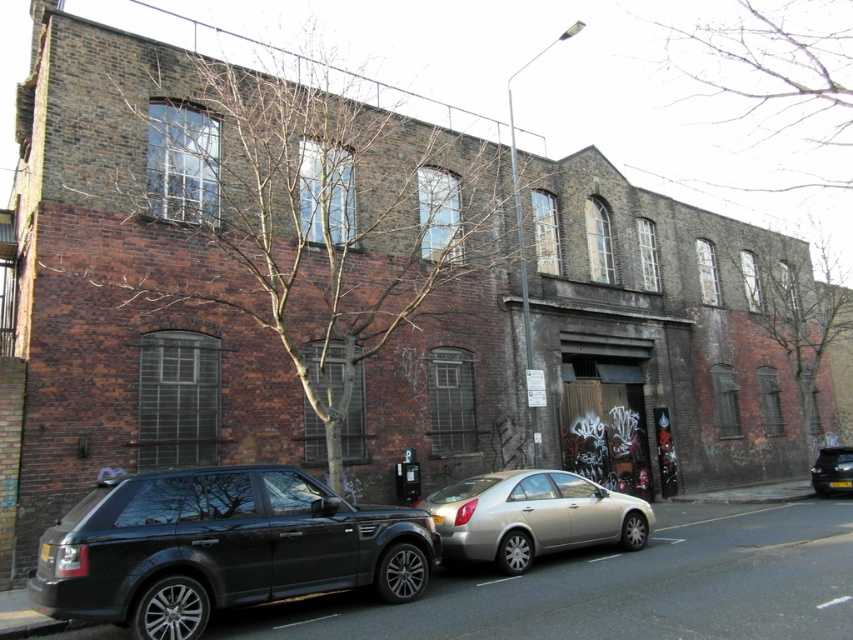
You are a delivery person trying to park your van between the shiny black suv at lower left and the metallic silver sedan at lower right. Can you fit your van, which is 2 meters wide, in the space between them?

The shiny black suv at lower left is positioned over metallic silver sedan at lower right, so there is no space between them. Your van cannot fit between them.

You are a pedestrian standing at the curb in front of the aged brick building. You see the shiny black suv at lower left and the metallic silver sedan at lower right. Which vehicle is closer to you?

The shiny black suv at lower left is closer to the viewer than the metallic silver sedan at lower right.

You are standing at the point with coordinates (x=219, y=547). What object are you standing on?

You are standing on the shiny black suv at lower left.